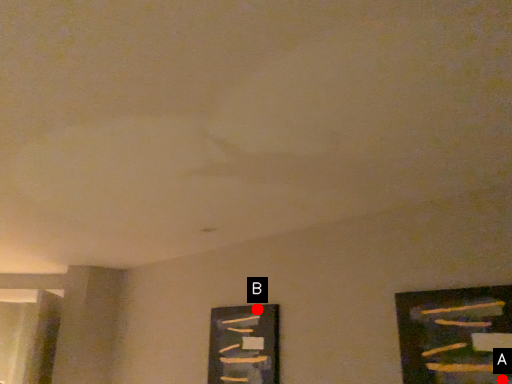
Question: Two points are circled on the image, labeled by A and B beside each circle. Which point is farther from the camera taking this photo?

Choices:
 (A) A is further
 (B) B is further

Answer: (B)